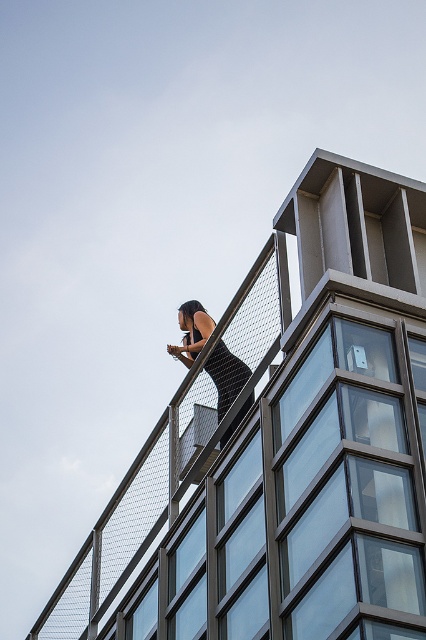
Question: Is metal mesh fence at upper center positioned at the back of black matte dress at upper center?

Choices:
 (A) no
 (B) yes

Answer: (A)

Question: Is metal mesh fence at upper center to the left of black matte dress at upper center from the viewer's perspective?

Choices:
 (A) no
 (B) yes

Answer: (B)

Question: Can you confirm if metal mesh fence at upper center is positioned below black matte dress at upper center?

Choices:
 (A) yes
 (B) no

Answer: (A)

Question: Among these points, which one is nearest to the camera?

Choices:
 (A) (219, 404)
 (B) (374, 376)

Answer: (B)

Question: Which object is closer to the camera taking this photo?

Choices:
 (A) black matte dress at upper center
 (B) metal mesh fence at upper center

Answer: (B)